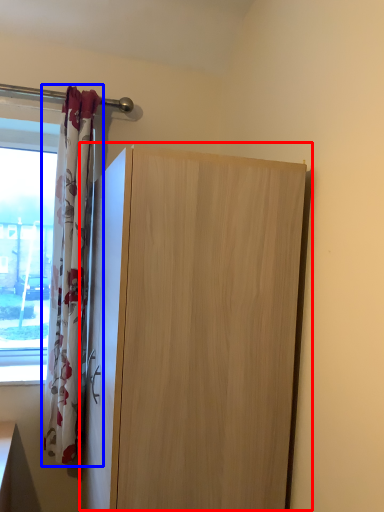
Question: Among these objects, which one is nearest to the camera, cupboard (highlighted by a red box) or curtain (highlighted by a blue box)?

Choices:
 (A) cupboard
 (B) curtain

Answer: (A)